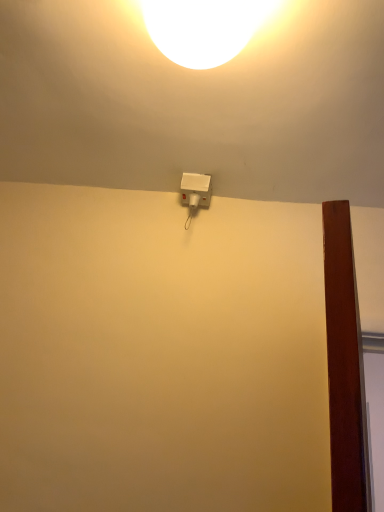
Measure the distance between white glossy light fixture at upper center and camera.

white glossy light fixture at upper center and camera are 23.07 inches apart.

In order to face white glossy light fixture at upper center, should I rotate leftwards or rightwards?

It's best to rotate right around 1.482 degrees.

Image resolution: width=384 pixels, height=512 pixels. I want to click on white glossy light fixture at upper center, so click(203, 28).

Image resolution: width=384 pixels, height=512 pixels. What do you see at coordinates (203, 28) in the screenshot?
I see `white glossy light fixture at upper center` at bounding box center [203, 28].

Locate an element on the screen. This screenshot has width=384, height=512. white glossy light fixture at upper center is located at coordinates (203, 28).